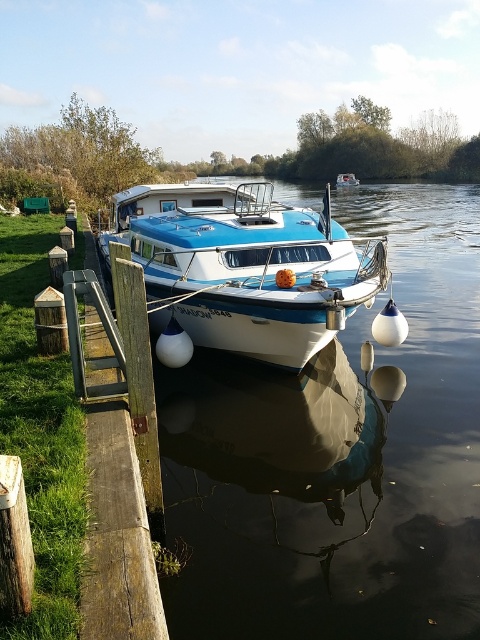
Question: Estimate the real-world distances between objects in this image. Which object is closer to the blue glossy boat at center?

Choices:
 (A) glossy white boat at center
 (B) blue glossy houseboat at center

Answer: (A)

Question: Which of the following is the farthest from the observer?

Choices:
 (A) (344, 186)
 (B) (167, 275)
 (C) (282, 564)

Answer: (A)

Question: Can you confirm if blue glossy houseboat at center is thinner than blue glossy boat at center?

Choices:
 (A) no
 (B) yes

Answer: (A)

Question: Can you confirm if blue glossy houseboat at center is positioned to the right of blue glossy boat at center?

Choices:
 (A) yes
 (B) no

Answer: (B)

Question: Which object is positioned farthest from the blue glossy houseboat at center?

Choices:
 (A) blue glossy boat at center
 (B) glossy white boat at center

Answer: (A)

Question: Does glossy white boat at center appear over blue glossy boat at center?

Choices:
 (A) yes
 (B) no

Answer: (B)